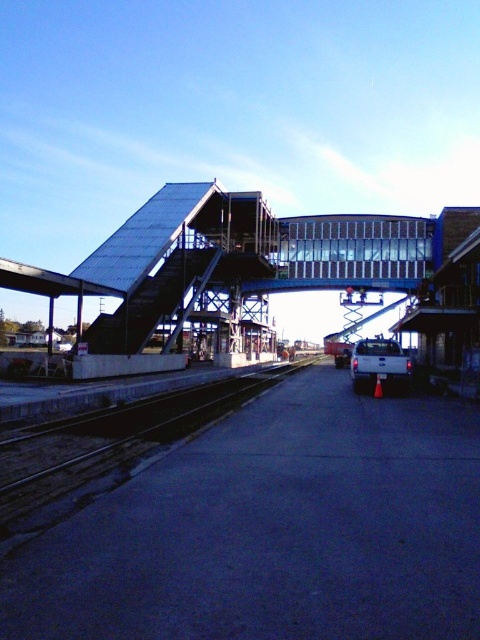
You are a maintenance worker standing on the metallic gray platform at center. You need to reach the dark gray concrete train track at center for inspection. How does the height difference between these two objects affect your task?

The metallic gray platform at center is higher than the dark gray concrete train track at center, so you will need to descend from the platform to reach the tracks safely.

You are a passenger trying to board a train at the station. The metallic gray platform at center is where you need to wait. The dark gray concrete train track at center is where the train will arrive. Based on the scene, which one is higher in elevation?

The metallic gray platform at center is located above the dark gray concrete train track at center, so the metallic gray platform at center is higher in elevation.